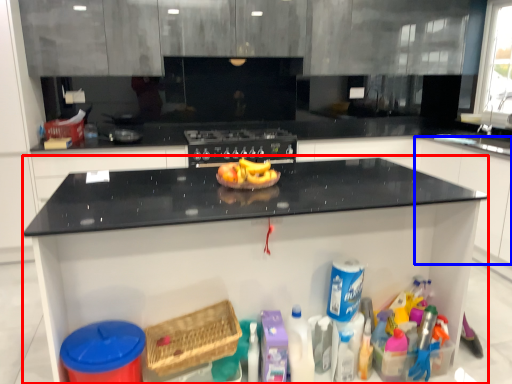
Question: Which point is further to the camera, countertop (highlighted by a red box) or cabinetry (highlighted by a blue box)?

Choices:
 (A) countertop
 (B) cabinetry

Answer: (B)